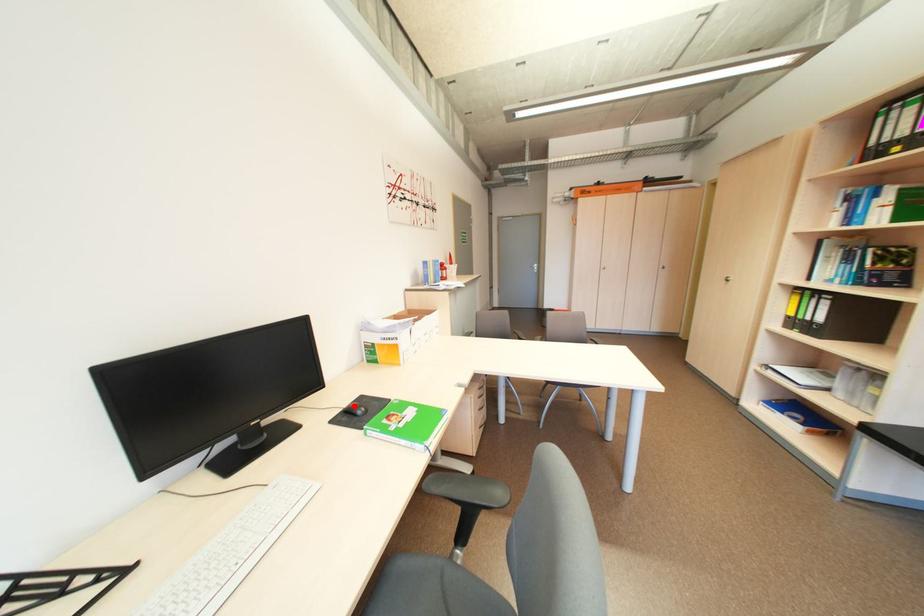
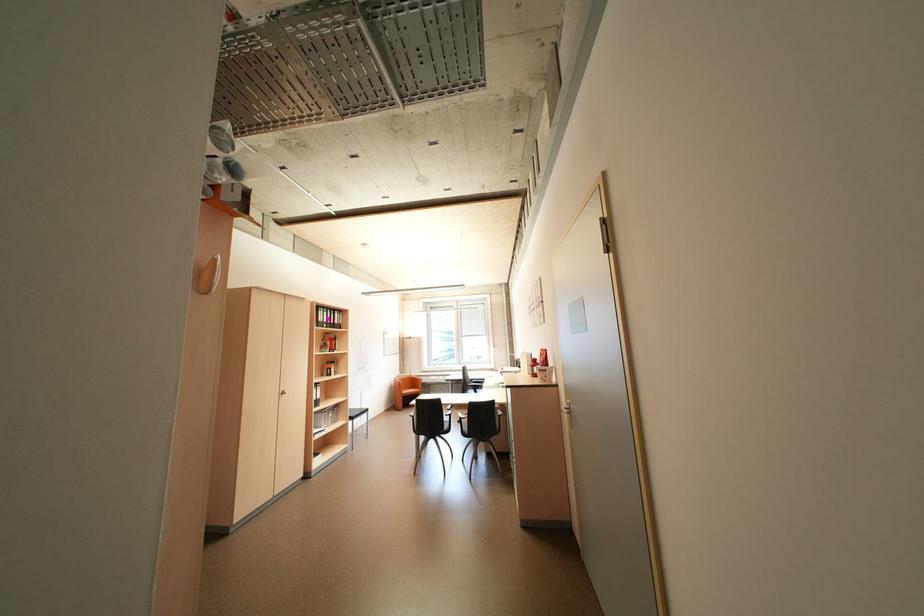
Question: I am providing you with two images of the same scene from different viewpoints. A red point is marked on the first image. At the location where the point appears in image 1, is it still visible in image 2?

Choices:
 (A) Yes
 (B) No

Answer: (B)